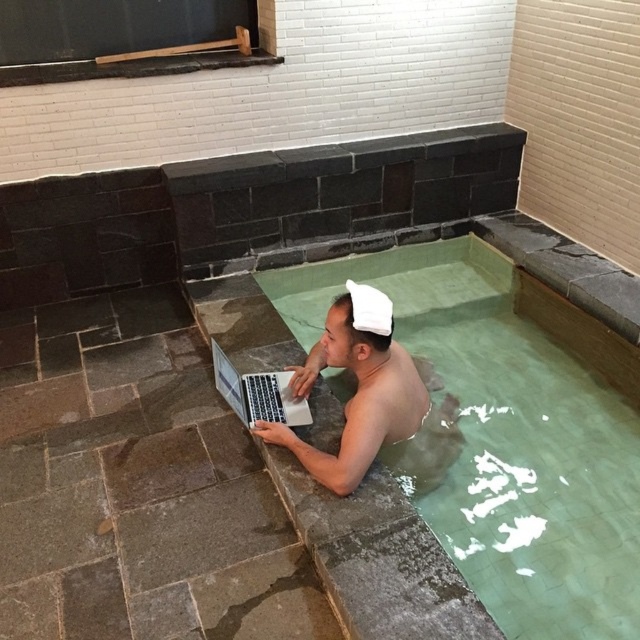
Question: Can you confirm if silver metallic laptop at lower center is smaller than white fabric baseball hat at upper center?

Choices:
 (A) yes
 (B) no

Answer: (B)

Question: Does green smooth stone pool at center have a larger size compared to silver metallic laptop at center?

Choices:
 (A) yes
 (B) no

Answer: (A)

Question: Among these points, which one is nearest to the camera?

Choices:
 (A) (362, 308)
 (B) (378, 298)
 (C) (216, 372)

Answer: (A)

Question: Which point is farther from the camera taking this photo?

Choices:
 (A) (365, 378)
 (B) (492, 333)
 (C) (234, 406)

Answer: (B)

Question: Can you confirm if green smooth stone pool at center is positioned above silver metallic laptop at lower center?

Choices:
 (A) no
 (B) yes

Answer: (B)

Question: Which object is positioned farthest from the green smooth stone pool at center?

Choices:
 (A) white fabric baseball hat at upper center
 (B) silver metallic laptop at center

Answer: (A)